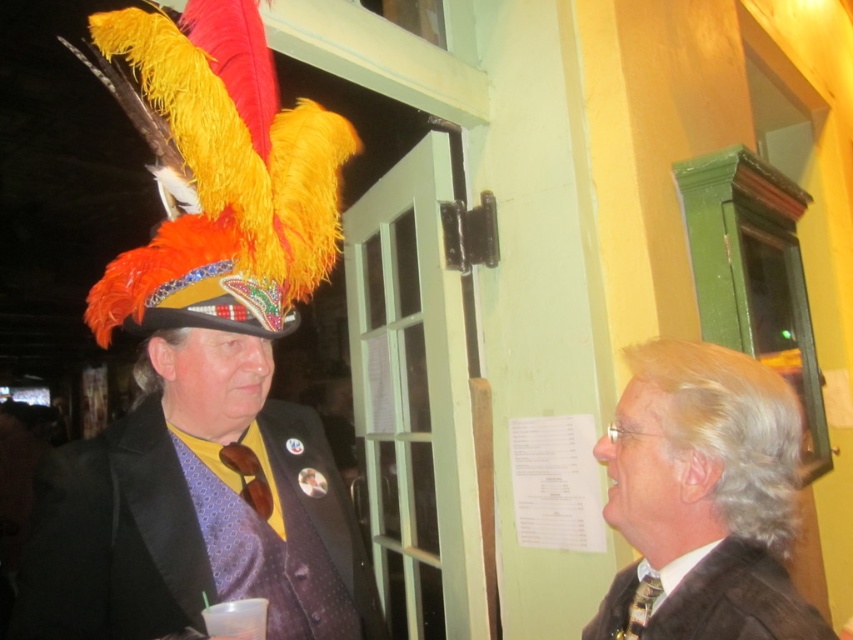
Question: Does feathered headdress at upper left appear on the left side of matte black suit at center?

Choices:
 (A) no
 (B) yes

Answer: (B)

Question: Which object is closer to the camera taking this photo?

Choices:
 (A) feathered headdress at upper left
 (B) matte black suit at right
 (C) matte black suit at center

Answer: (B)

Question: Where is matte black suit at center located in relation to dark brown fabric business suit at right in the image?

Choices:
 (A) right
 (B) left

Answer: (B)

Question: Which of these objects is positioned farthest from the matte black suit at right?

Choices:
 (A) feathered headdress at upper left
 (B) matte black suit at center

Answer: (A)

Question: Is matte black suit at center smaller than matte black suit at right?

Choices:
 (A) yes
 (B) no

Answer: (B)

Question: Estimate the real-world distances between objects in this image. Which object is farther from the feathered headdress at upper left?

Choices:
 (A) matte black suit at right
 (B) matte black suit at center
 (C) dark brown fabric business suit at right

Answer: (C)